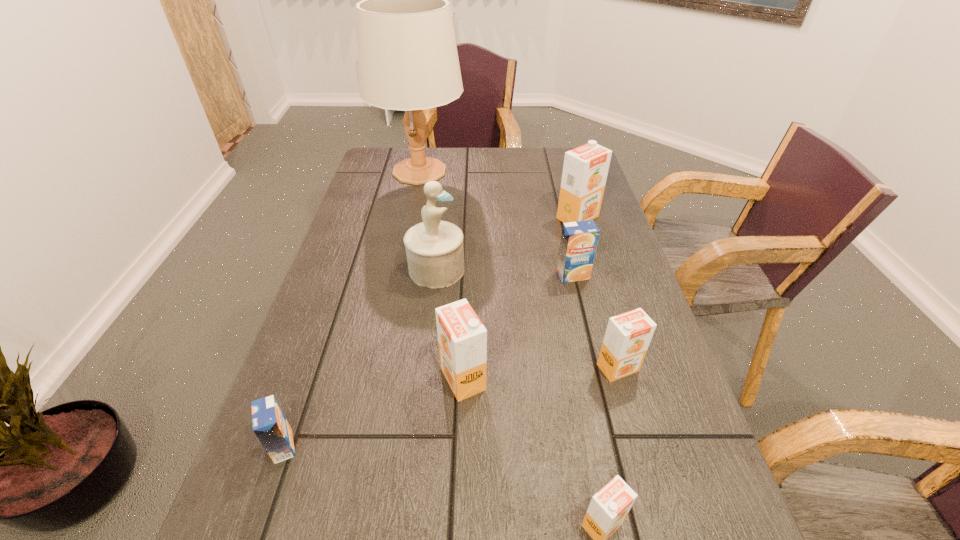
Find the location of a particular element. the tallest object is located at coordinates (407, 55).

Where is `the farthest object`? This screenshot has width=960, height=540. the farthest object is located at coordinates (407, 55).

At what (x,y) coordinates should I click in order to perform the action: click on white figurine. Please return your answer as a coordinate pair (x, y). The image size is (960, 540). Looking at the image, I should click on (x=435, y=253).

What are the coordinates of `the farthest orange orange juice` in the screenshot? It's located at (585, 169).

Locate an element on the screen. The image size is (960, 540). the farthest orange juice is located at coordinates coord(585,169).

Image resolution: width=960 pixels, height=540 pixels. Find the location of `the leftmost orange orange juice`. the leftmost orange orange juice is located at coordinates tap(462, 338).

Where is `the second biggest orange orange juice`? The image size is (960, 540). the second biggest orange orange juice is located at coordinates (462, 338).

Find the location of a particular element. The height and width of the screenshot is (540, 960). the farther blue orange_juice is located at coordinates (579, 240).

The image size is (960, 540). Find the location of `the fifth nearest orange juice`. the fifth nearest orange juice is located at coordinates (579, 240).

Where is `the third biggest orange orange juice`? This screenshot has width=960, height=540. the third biggest orange orange juice is located at coordinates (628, 335).